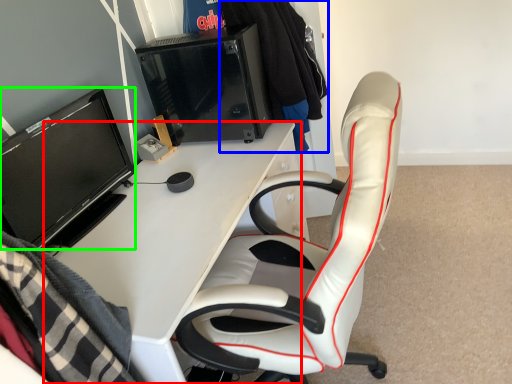
Question: Which object is the farthest from desk (highlighted by a red box)? Choose among these: clothing (highlighted by a blue box) or television (highlighted by a green box).

Choices:
 (A) clothing
 (B) television

Answer: (A)